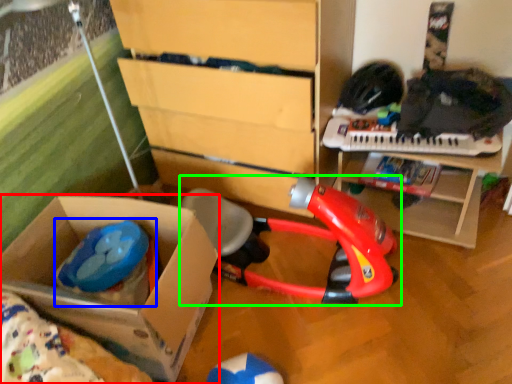
Question: Estimate the real-world distances between objects in this image. Which object is closer to box (highlighted by a red box), toy (highlighted by a blue box) or toy (highlighted by a green box)?

Choices:
 (A) toy
 (B) toy

Answer: (A)